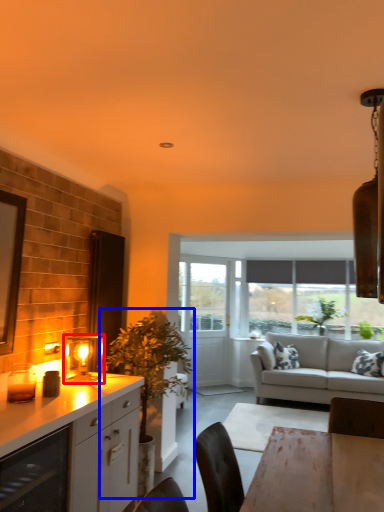
Question: Among these objects, which one is farthest to the camera, light fixture (highlighted by a red box) or houseplant (highlighted by a blue box)?

Choices:
 (A) light fixture
 (B) houseplant

Answer: (B)